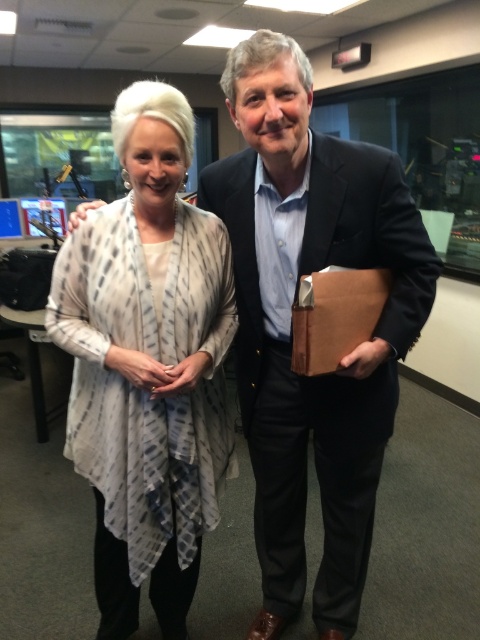
Does matte black suit at center appear on the left side of printed silk blouse at center?

In fact, matte black suit at center is to the right of printed silk blouse at center.

Is matte black suit at center shorter than printed silk blouse at center?

In fact, matte black suit at center may be taller than printed silk blouse at center.

Find the location of `matte black suit at center`. matte black suit at center is located at coordinates (290, 324).